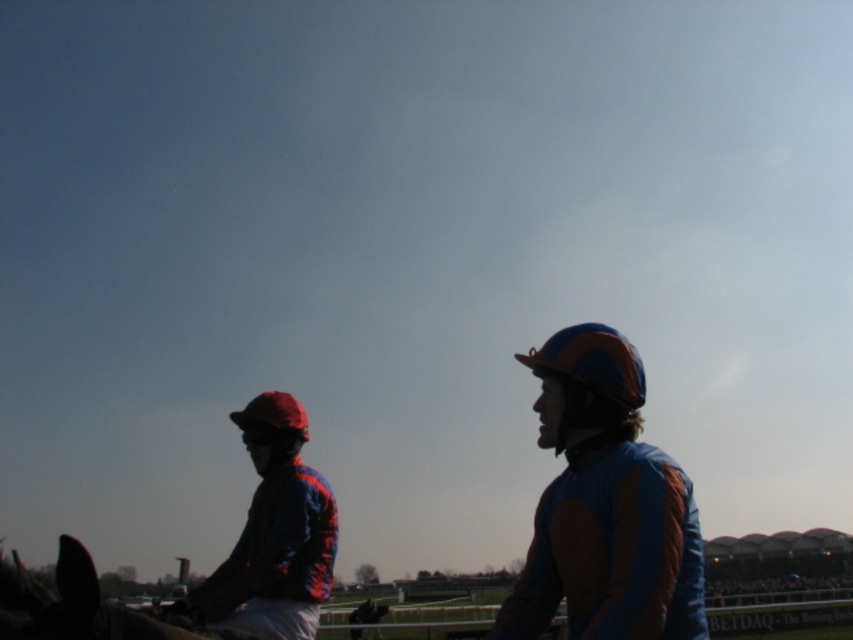
Question: Among these objects, which one is nearest to the camera?

Choices:
 (A) shiny blue fabric jockey at left
 (B) blue matte helmet at center
 (C) shiny blue and orange jockey suit at center

Answer: (C)

Question: Considering the relative positions of blue matte helmet at center and shiny blue fabric jockey at left in the image provided, where is blue matte helmet at center located with respect to shiny blue fabric jockey at left?

Choices:
 (A) right
 (B) left

Answer: (A)

Question: Which point is closer to the camera taking this photo?

Choices:
 (A) (215, 624)
 (B) (592, 625)

Answer: (B)

Question: Can you confirm if shiny blue and orange jockey suit at center is positioned below blue matte helmet at center?

Choices:
 (A) no
 (B) yes

Answer: (A)

Question: Estimate the real-world distances between objects in this image. Which object is closer to the shiny blue and orange jockey suit at center?

Choices:
 (A) blue matte helmet at center
 (B) shiny blue fabric jockey at left

Answer: (A)

Question: Considering the relative positions of shiny blue and orange jockey suit at center and blue matte helmet at center in the image provided, where is shiny blue and orange jockey suit at center located with respect to blue matte helmet at center?

Choices:
 (A) left
 (B) right

Answer: (A)